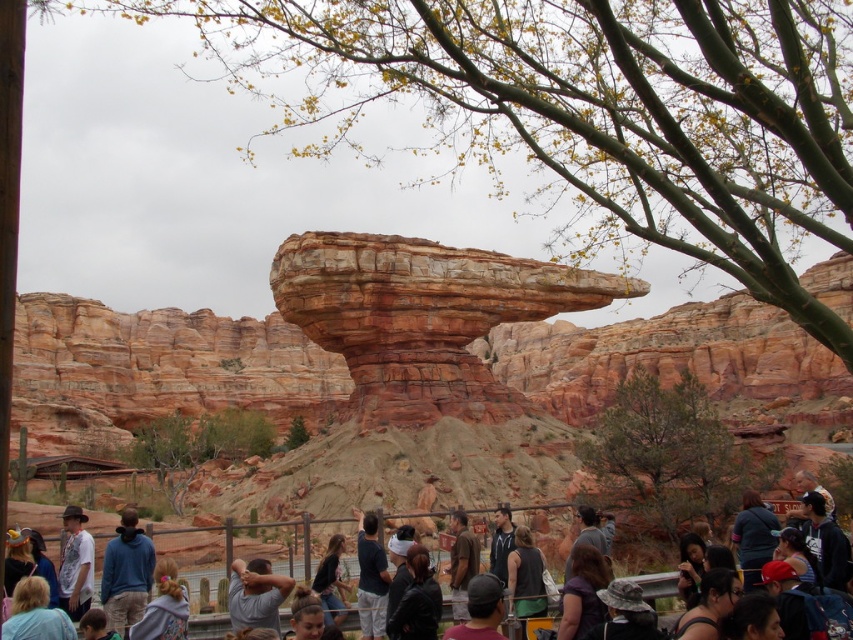
You are standing in the desert scene and want to place your matte black sunglasses at lower right on top of the denim jacket at center. Will the sunglasses fit entirely on the jacket without hanging off the edges?

The matte black sunglasses at lower right has a lesser width compared to the denim jacket at center, so the sunglasses will fit entirely on the jacket without hanging off the edges.

You are a photographer setting up a tripod in this desert scene. You need to position your tripod so that it doesn not block the view of the denim jacket at center and the matte black sunglasses at lower right. Given their positions, which object should you place the tripod to the left of to ensure both remain visible?

You should place the tripod to the left of the denim jacket at center. Since the matte black sunglasses at lower right are to the right of the denim jacket at center, positioning the tripod to the left of the denim jacket at center keeps both objects visible without obstruction.

You are a photographer standing in the desert scene. You want to take a photo of the black leather jacket at center and the matte black sunglasses at lower right. Based on their positions, which object should you focus on first to ensure both are in the frame?

The black leather jacket at center is below matte black sunglasses at lower right, so you should focus on the matte black sunglasses at lower right first to ensure both are in the frame.